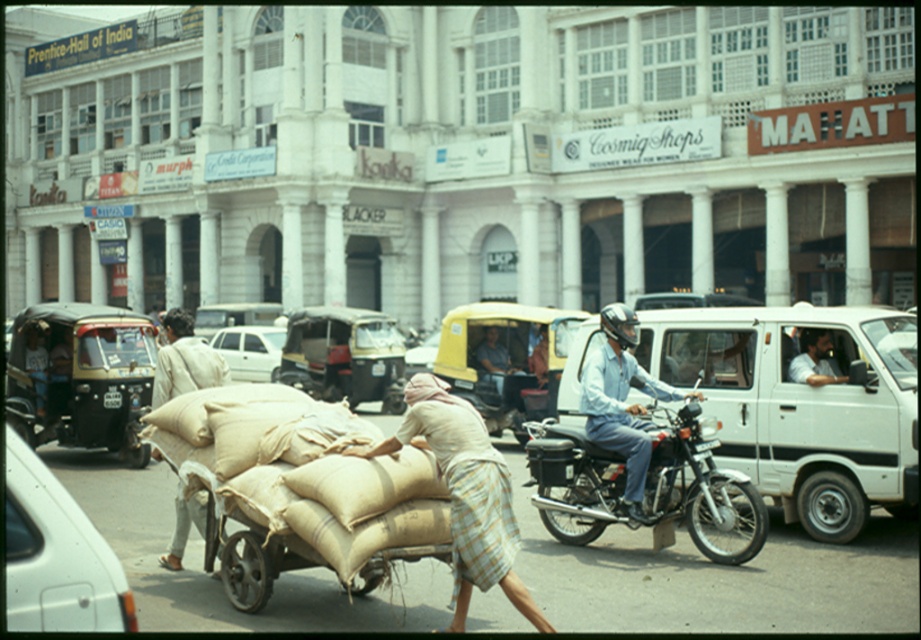
Is white matte van at center-right bigger than shiny black motorcycle at center?

No, white matte van at center-right is not bigger than shiny black motorcycle at center.

Which is more to the right, white matte van at center-right or shiny black motorcycle at center?

From the viewer's perspective, white matte van at center-right appears more on the right side.

Which is in front, point (691, 312) or point (585, 468)?

Point (585, 468) is more forward.

Locate an element on the screen. This screenshot has height=640, width=921. white matte van at center-right is located at coordinates (802, 403).

What do you see at coordinates (802, 403) in the screenshot?
I see `white matte van at center-right` at bounding box center [802, 403].

Does white matte van at center-right appear on the right side of metallic silver car at center?

Indeed, white matte van at center-right is positioned on the right side of metallic silver car at center.

Between point (735, 349) and point (426, 352), which one is positioned behind?

The point (426, 352) is behind.

The height and width of the screenshot is (640, 921). What are the coordinates of `white matte van at center-right` in the screenshot? It's located at coord(802,403).

Is light blue denim shirt at center to the left of beige sack at lower left from the viewer's perspective?

In fact, light blue denim shirt at center is to the right of beige sack at lower left.

Does point (604, 413) lie in front of point (228, 371)?

Yes, point (604, 413) is in front of point (228, 371).

Locate an element on the screen. light blue denim shirt at center is located at coordinates (622, 401).